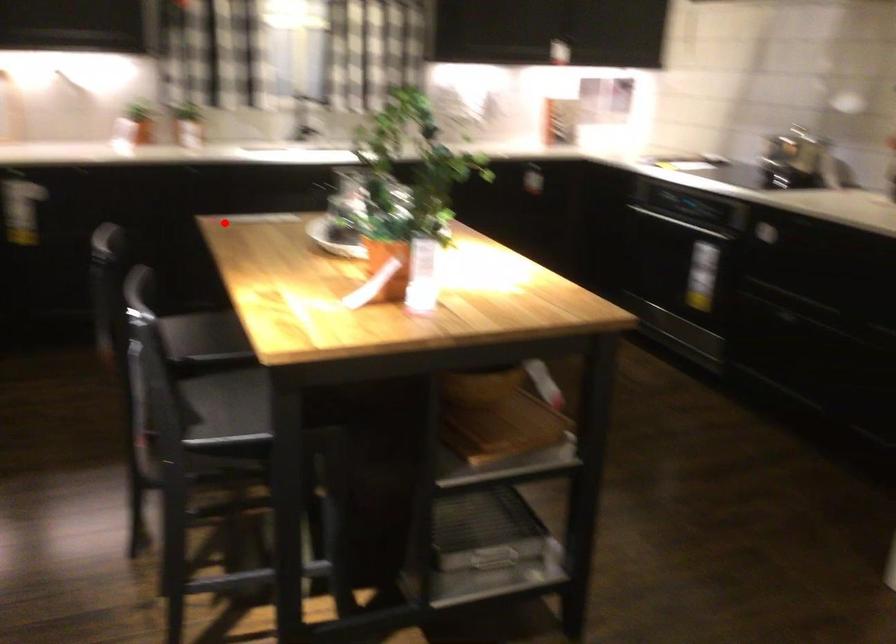
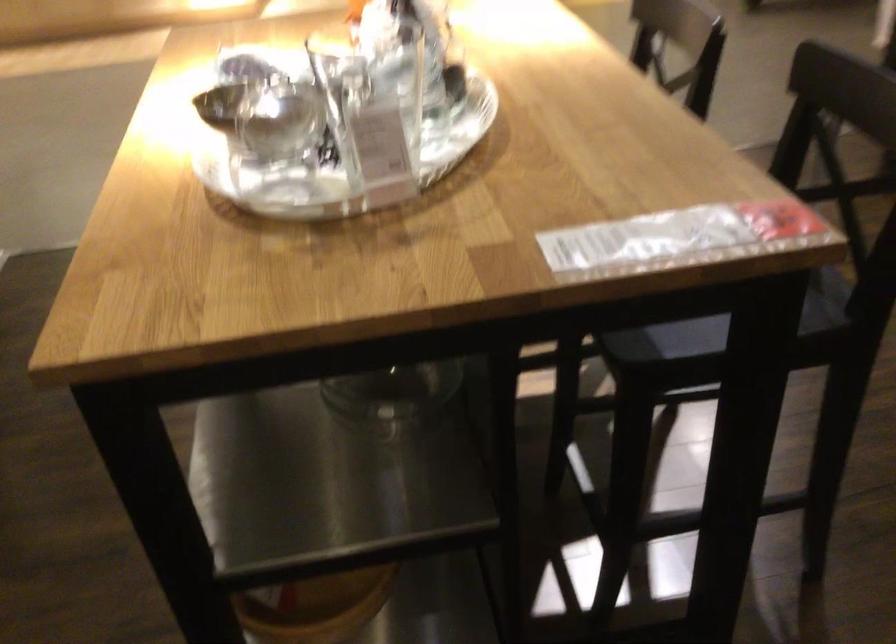
Question: I am providing you with two images of the same scene from different viewpoints. Given a red point in image1, look at the same physical point in image2. Is it:

Choices:
 (A) Closer to the viewpoint
 (B) Farther from the viewpoint

Answer: (A)